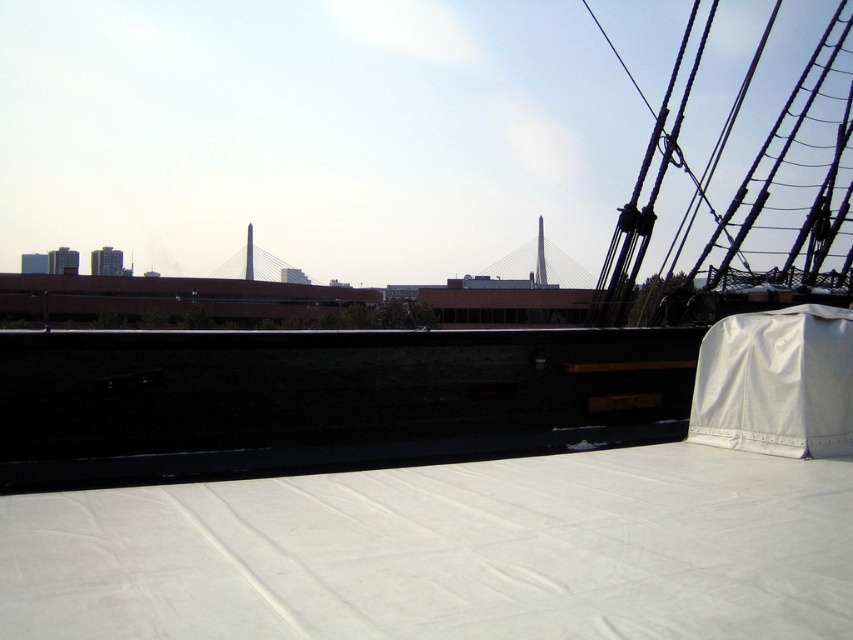
Is white matte sheet at lower center thinner than white fabric cover at upper right?

No, white matte sheet at lower center is not thinner than white fabric cover at upper right.

Is white matte sheet at lower center below white fabric cover at upper right?

Yes.

Who is more distant from viewer, (216, 582) or (724, 352)?

Point (724, 352)

Locate an element on the screen. The height and width of the screenshot is (640, 853). white matte sheet at lower center is located at coordinates (445, 552).